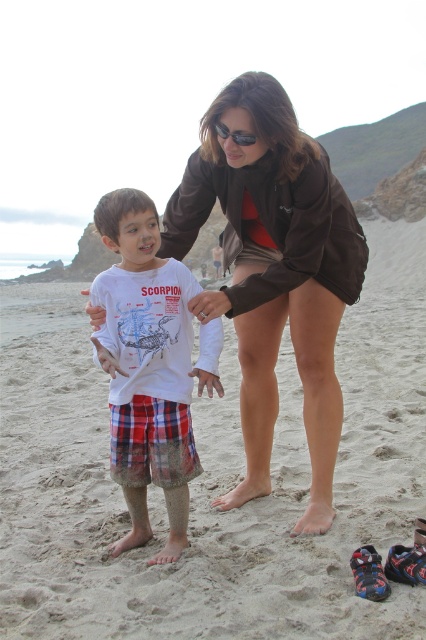
You are a photographer standing at the edge of the sandy beach at center. You want to take a photo of the white cotton shirt at center. Which object is closer to your camera lens?

The sandy beach at center is closer to the viewer than the white cotton shirt at center, so the sandy beach at center will appear closer to the camera lens.

You are standing at the point marked as point (213, 481) on the sandy beach at center. You want to walk towards the child wearing a scorpion graphic T shirt on the left. Which direction should you go?

The point (213, 481) is on the sandy beach at center. The child wearing a scorpion graphic T shirt on the left is located to the left of the center point. Therefore, you should walk towards the left direction from the point 0.752, 0.750 to reach the child.

You are a photographer trying to capture a candid shot of the scene. You want to ensure the sandy beach at center and the white cotton shirt at center are both in frame. Based on their positions, which object should you focus on first to ensure both are captured?

The sandy beach at center is to the left of white cotton shirt at center, so focusing on the white cotton shirt at center first would allow you to frame both objects since the beach is positioned to its left.